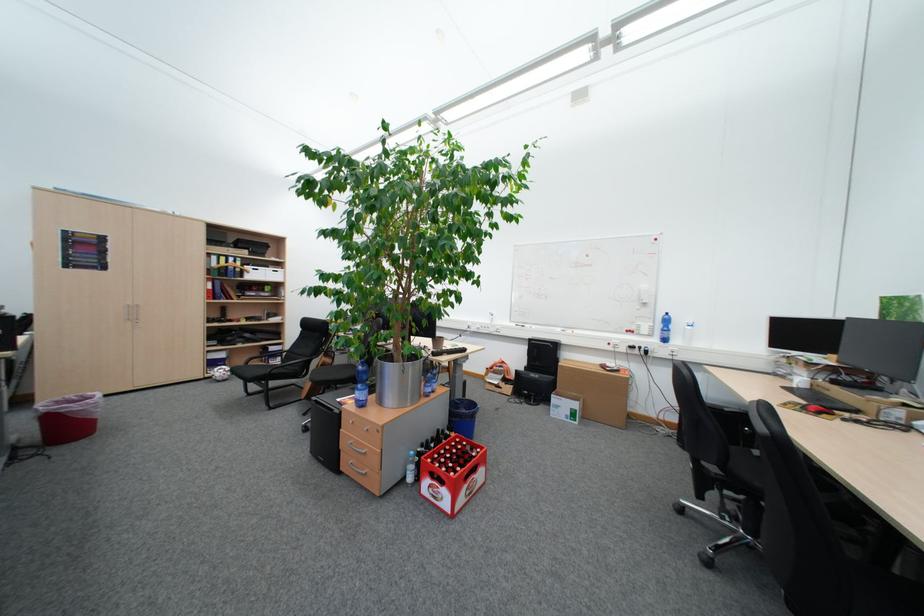
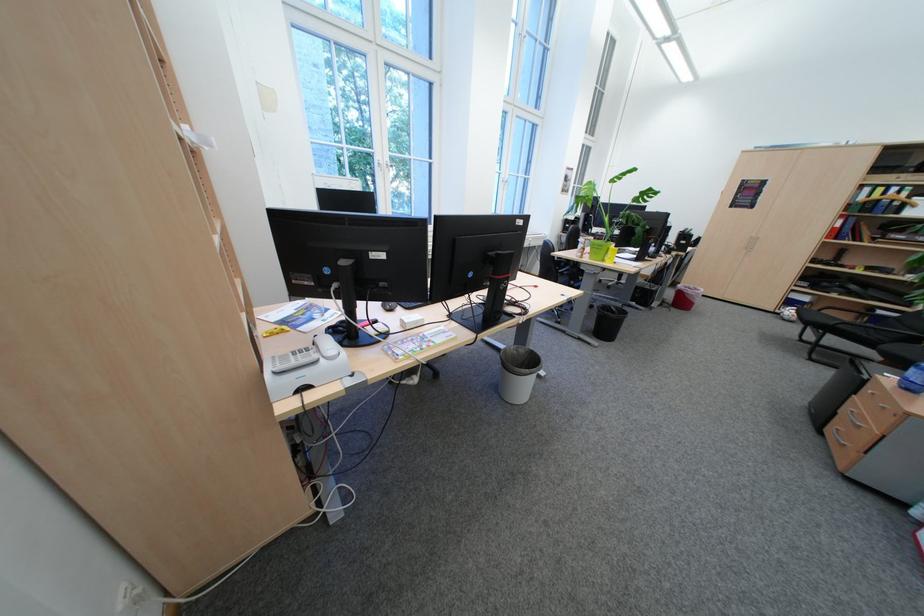
In the second image, find the point that corresponds to point (350, 452) in the first image.

(847, 414)